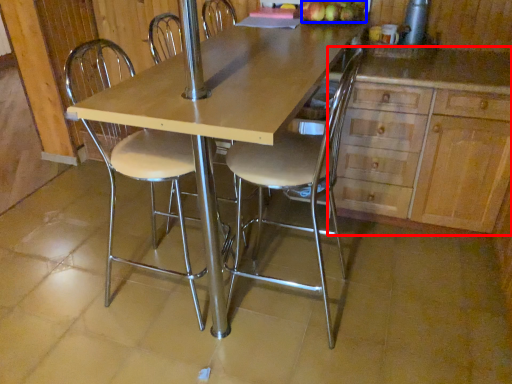
Question: Which of the following is the farthest to the observer, cabinetry (highlighted by a red box) or apple (highlighted by a blue box)?

Choices:
 (A) cabinetry
 (B) apple

Answer: (B)